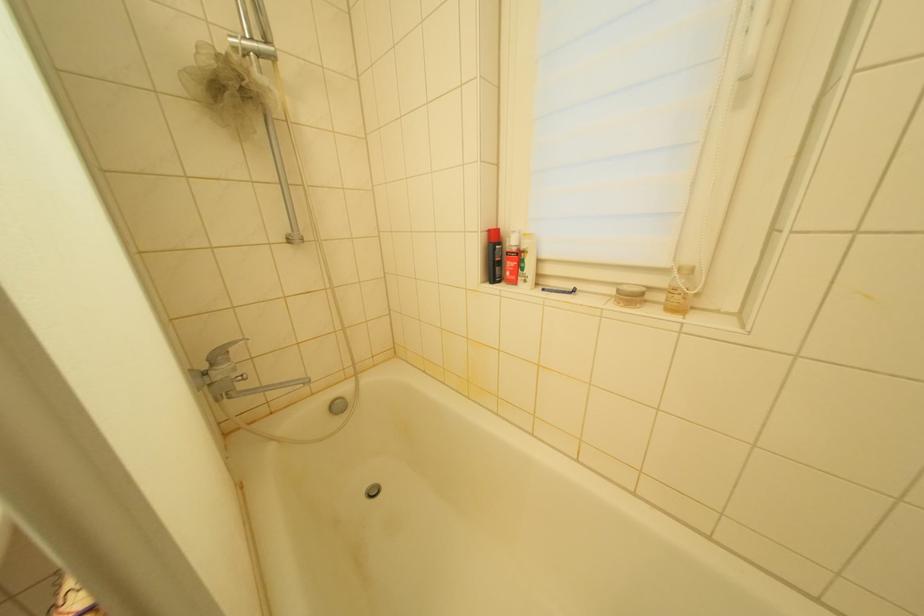
The width and height of the screenshot is (924, 616). Describe the element at coordinates (629, 294) in the screenshot. I see `the clear bottle cap` at that location.